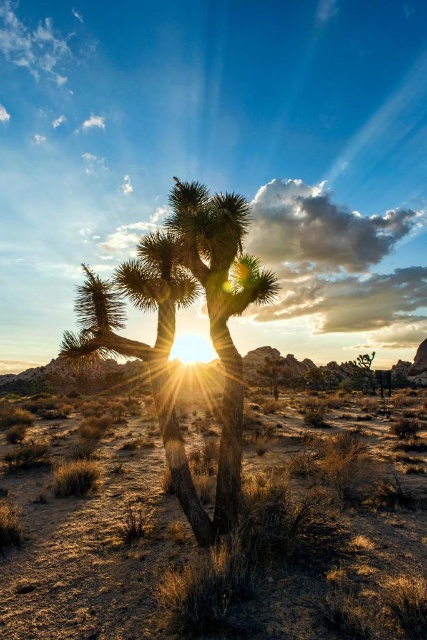
Between point (175, 557) and point (190, 204), which one is positioned in front?

Point (175, 557) is in front.

I want to click on brown textured desert at center, so click(225, 548).